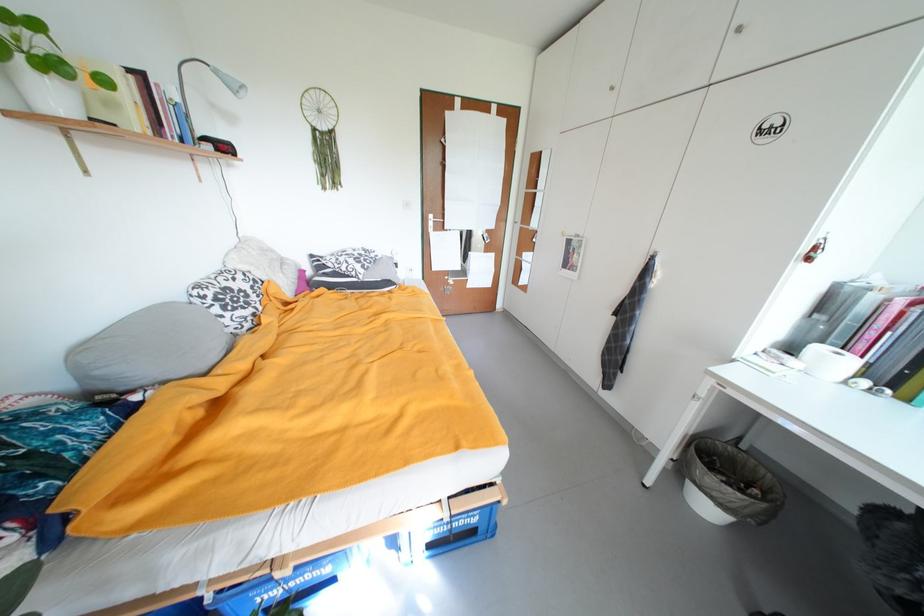
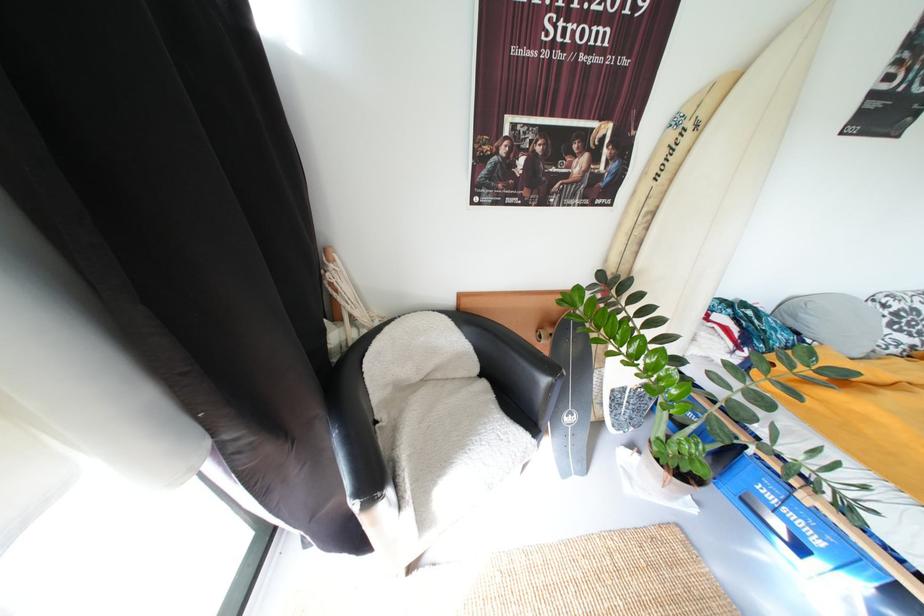
How did the camera likely rotate?

The camera rotated toward left-down.